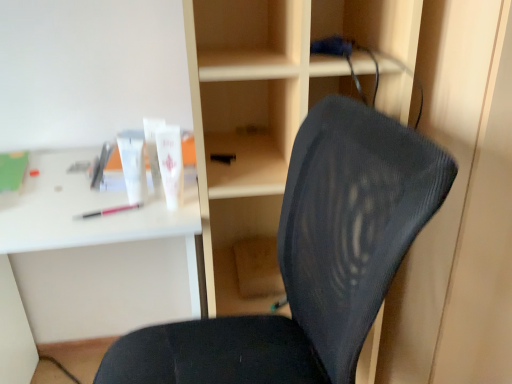
Question: Is black mesh chair at center in front of or behind white matte tube at upper center, the 3th toiletry in the left-to-right sequence, in the image?

Choices:
 (A) front
 (B) behind

Answer: (A)

Question: From a real-world perspective, is black mesh chair at center positioned above or below white matte tube at upper center, the first toiletry from the right?

Choices:
 (A) above
 (B) below

Answer: (B)

Question: Based on their relative distances, which object is nearer to the black mesh chair at center?

Choices:
 (A) pink plastic pen at left
 (B) wooden at center
 (C) white plastic desk at upper left
 (D) white matte tube at upper left, the 1th toiletry in the left-to-right sequence
 (E) white matte tube at upper center, the first toiletry from the right

Answer: (B)

Question: Which object is positioned closest to the wooden at center?

Choices:
 (A) white plastic desk at upper left
 (B) white matte tube at upper left, the 1th toiletry in the left-to-right sequence
 (C) white glossy tube at upper center, the 2th toiletry viewed from the right
 (D) white matte tube at upper center, the 3th toiletry in the left-to-right sequence
 (E) black mesh chair at center

Answer: (E)